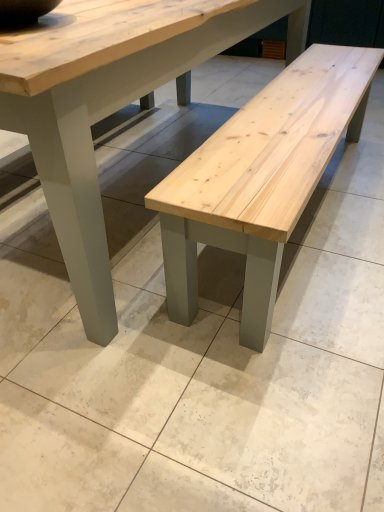
Locate an element on the screen. This screenshot has width=384, height=512. vacant space in natural wood table at center (from a real-world perspective) is located at coordinates (144, 180).